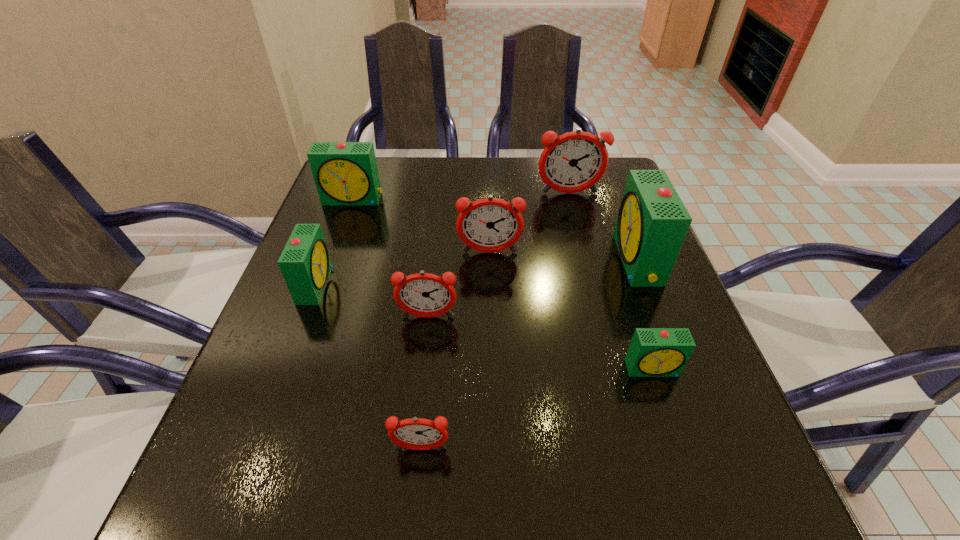
Where is `the farthest reddish-pink alarm clock`? The width and height of the screenshot is (960, 540). the farthest reddish-pink alarm clock is located at coordinates (575, 161).

Locate an element on the screen. The height and width of the screenshot is (540, 960). the biggest reddish-pink alarm clock is located at coordinates (575, 161).

At what (x,y) coordinates should I click in order to perform the action: click on the biggest green alarm clock. Please return your answer as a coordinate pair (x, y). Looking at the image, I should click on (652, 223).

Identify the location of the third nearest reddish-pink alarm clock. This screenshot has width=960, height=540. (489, 225).

Find the location of a particular element. The height and width of the screenshot is (540, 960). the farthest green alarm clock is located at coordinates (345, 173).

This screenshot has height=540, width=960. What are the coordinates of `the sixth farthest alarm clock` in the screenshot? It's located at (426, 295).

Identify the location of the second smallest reddish-pink alarm clock. Image resolution: width=960 pixels, height=540 pixels. (426, 295).

Locate an element on the screen. the second smallest green alarm clock is located at coordinates (305, 263).

Where is `the nearest alarm clock`? Image resolution: width=960 pixels, height=540 pixels. the nearest alarm clock is located at coordinates pyautogui.click(x=415, y=433).

This screenshot has height=540, width=960. What are the coordinates of `the nearest object` in the screenshot? It's located at pyautogui.click(x=415, y=433).